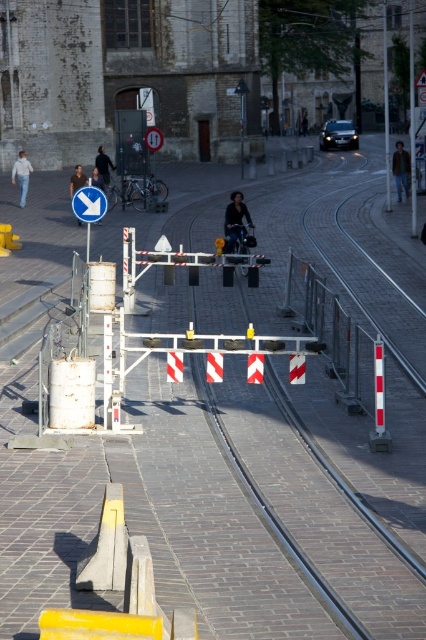
You are a delivery person who needs to attach a package to the metallic pole at upper right and the dark blue leather jacket at center. Which object can the package be securely attached to?

The metallic pole at upper right can securely hold the package because it is larger in size than the dark blue leather jacket at center.

You are a pedestrian standing at the tram crossing. You see a metallic pole at center and light blue jeans at left. Which object is higher from the ground?

The metallic pole at center is higher from the ground than the light blue jeans at left.

You are a delivery drone flying over an urban street scene with tram tracks. You need to land near the metallic pole at center. What coordinates should you target for landing?

You should target the coordinates point at point (385, 112) to land near the metallic pole at center.